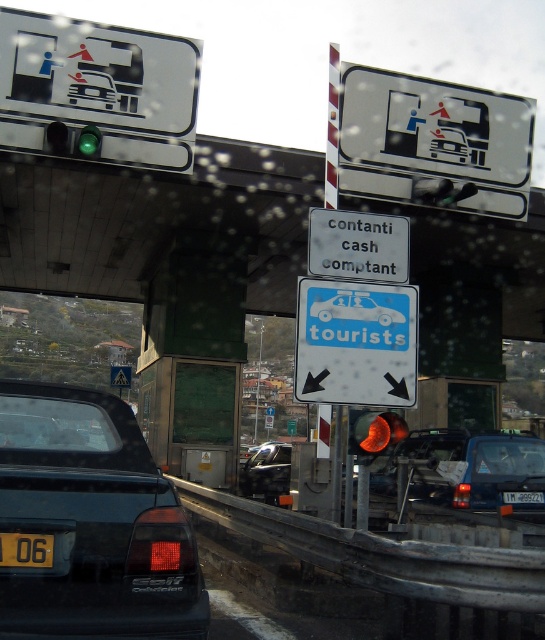
Question: Is matte black car at lower left below yellow reflective triangle at center?

Choices:
 (A) no
 (B) yes

Answer: (A)

Question: Is blue matte van at center bigger than green glass traffic light at upper left?

Choices:
 (A) no
 (B) yes

Answer: (B)

Question: Can you confirm if white plastic sign at center is positioned above yellow plastic license plate at center?

Choices:
 (A) yes
 (B) no

Answer: (A)

Question: Which object is farther from the camera taking this photo?

Choices:
 (A) white plastic sign at center
 (B) yellow matte license plate at lower left

Answer: (A)

Question: Considering the real-world distances, which object is closest to the yellow reflective triangle at center?

Choices:
 (A) blue matte van at center
 (B) metallic silver car at center
 (C) matte orange traffic light at center

Answer: (B)

Question: Estimate the real-world distances between objects in this image. Which object is farther from the white plastic sign at center?

Choices:
 (A) matte orange traffic light at center
 (B) blue plastic sign at center

Answer: (A)